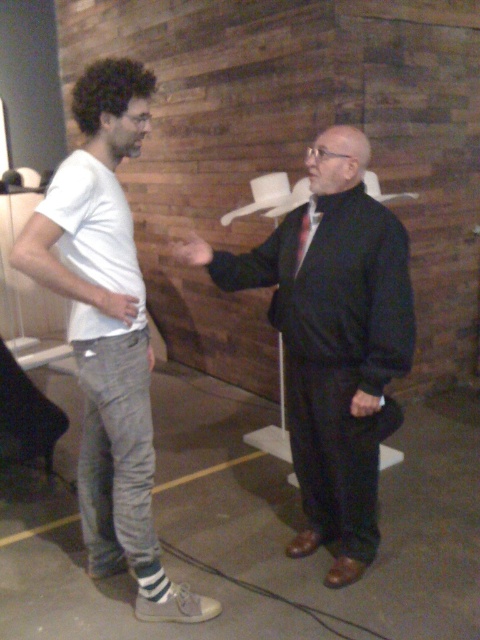
You are taking a photo of the two people in the scene. The first person is at point (134, 72) and the second person is at point (172, 250). Which person will appear larger in the photo?

Point (134, 72) is closer to the camera than point (172, 250), so the first person at point (134, 72) will appear larger in the photo.

You are a photographer trying to capture a candid shot of the two people in the scene. The camera you are using has a depth of field that can focus on objects within a 50 cm range. Given that the dark red silk tie at center and smooth black hand at center are 55.21 centimeters apart, will both subjects be in focus in the photo?

The dark red silk tie at center and smooth black hand at center are 55.21 centimeters apart. Since the camera can only focus on objects within a 50 cm range, the distance between them exceeds this limit. Therefore, both subjects cannot be in focus simultaneously in the photo.